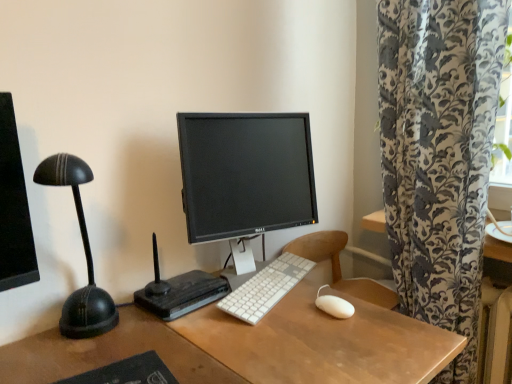
In order to face black rubber mousepad at lower left, should I rotate leftwards or rightwards?

A 19.798 degree turn to the left will do.

Locate an element on the screen. Image resolution: width=512 pixels, height=384 pixels. black plastic router at center is located at coordinates (179, 291).

At what (x,y) coordinates should I click in order to perform the action: click on black rubber mousepad at lower left. Please return your answer as a coordinate pair (x, y). The height and width of the screenshot is (384, 512). Looking at the image, I should click on (127, 372).

Does black rubber mousepad at lower left have a lesser width compared to white plastic keyboard at center?

No, black rubber mousepad at lower left is not thinner than white plastic keyboard at center.

From a real-world perspective, who is located lower, black rubber mousepad at lower left or white plastic keyboard at center?

In real-world perspective, black rubber mousepad at lower left is lower.

Does black rubber mousepad at lower left appear on the right side of white plastic keyboard at center?

Incorrect, black rubber mousepad at lower left is not on the right side of white plastic keyboard at center.

Who is smaller, black rubber mousepad at lower left or white plastic keyboard at center?

With smaller size is black rubber mousepad at lower left.

In the scene shown: Can black plastic router at center be found inside black rubber mousepad at lower left?

No, black plastic router at center is not a part of black rubber mousepad at lower left.

Locate an element on the screen. equipment behind the black rubber mousepad at lower left is located at coordinates (179, 291).

Is black rubber mousepad at lower left turned away from black plastic router at center?

black rubber mousepad at lower left does not have its back to black plastic router at center.

From a real-world perspective, who is located lower, black rubber mousepad at lower left or black plastic router at center?

From a 3D spatial view, black rubber mousepad at lower left is below.

Is black glossy monitor at center inside the boundaries of white matte mouse at center, or outside?

black glossy monitor at center is not inside white matte mouse at center, it's outside.

Is black glossy monitor at center not close to white matte mouse at center?

They are positioned close to each other.

How much distance is there between black glossy monitor at center and white matte mouse at center?

15.59 inches.

From a real-world perspective, between black glossy monitor at center and white matte mouse at center, who is vertically higher?

black glossy monitor at center, from a real-world perspective.

This screenshot has width=512, height=384. In order to click on computer monitor above the black plastic router at center (from the image's perspective) in this screenshot , I will do `click(245, 174)`.

In the scene shown: Is the position of black glossy monitor at center more distant than that of black plastic router at center?

Yes, black glossy monitor at center is behind black plastic router at center.

From a real-world perspective, is black glossy monitor at center physically below black plastic router at center?

No, from a real-world perspective, black glossy monitor at center is not below black plastic router at center.

Does black glossy monitor at center turn towards black plastic router at center?

No, black glossy monitor at center is not oriented towards black plastic router at center.

Is white matte mouse at center wider or thinner than black plastic router at center?

Considering their sizes, white matte mouse at center looks slimmer than black plastic router at center.

From the image's perspective, is white matte mouse at center on black plastic router at center?

No, from the image's perspective, white matte mouse at center is not above black plastic router at center.

From the picture: Does white matte mouse at center have a larger size compared to black plastic router at center?

No, white matte mouse at center is not bigger than black plastic router at center.

The height and width of the screenshot is (384, 512). I want to click on equipment above the white matte mouse at center (from a real-world perspective), so click(x=179, y=291).

Is black plastic router at center surrounded by white plastic keyboard at center?

Actually, black plastic router at center is outside white plastic keyboard at center.

From the image's perspective, which is above, white plastic keyboard at center or black plastic router at center?

black plastic router at center.

Is white plastic keyboard at center facing towards black plastic router at center?

No, white plastic keyboard at center is not aimed at black plastic router at center.

At what (x,y) coordinates should I click in order to perform the action: click on computer keyboard that appears below the black plastic router at center (from a real-world perspective). Please return your answer as a coordinate pair (x, y). The image size is (512, 384). Looking at the image, I should click on (265, 288).

How much distance is there between black plastic router at center and black glossy monitor at center?

10.53 inches.

Considering the relative sizes of black plastic router at center and black glossy monitor at center in the image provided, is black plastic router at center smaller than black glossy monitor at center?

Correct, black plastic router at center occupies less space than black glossy monitor at center.

Considering the sizes of black plastic router at center and black glossy monitor at center in the image, is black plastic router at center taller or shorter than black glossy monitor at center?

In the image, black plastic router at center appears to be shorter than black glossy monitor at center.

From the image's perspective, between black plastic router at center and black glossy monitor at center, which one is located above?

Answer: black glossy monitor at center appears higher in the image.

At what (x,y) coordinates should I click in order to perform the action: click on computer keyboard on the right of black rubber mousepad at lower left. Please return your answer as a coordinate pair (x, y). The height and width of the screenshot is (384, 512). Looking at the image, I should click on (265, 288).

I want to click on mousepad that is below the black plastic router at center (from the image's perspective), so click(x=127, y=372).

When comparing their distances from black rubber mousepad at lower left, does white plastic keyboard at center or black plastic router at center seem further?

Based on the image, white plastic keyboard at center appears to be further to black rubber mousepad at lower left.

From the image, which object appears to be farther from white plastic keyboard at center, black glossy monitor at center or black rubber mousepad at lower left?

The object further to white plastic keyboard at center is black rubber mousepad at lower left.

Looking at the image, which one is located further to white matte mouse at center, white plastic keyboard at center or black glossy monitor at center?

black glossy monitor at center is further to white matte mouse at center.

Looking at the image, which one is located closer to black glossy monitor at center, black rubber mousepad at lower left or white plastic keyboard at center?

white plastic keyboard at center.

When comparing their distances from white plastic keyboard at center, does black rubber mousepad at lower left or white matte mouse at center seem further?

black rubber mousepad at lower left is further to white plastic keyboard at center.

When comparing their distances from black glossy monitor at center, does white plastic keyboard at center or black rubber mousepad at lower left seem further?

Among the two, black rubber mousepad at lower left is located further to black glossy monitor at center.

From the image, which object appears to be nearer to black plastic router at center, black glossy monitor at center or white plastic keyboard at center?

Based on the image, white plastic keyboard at center appears to be nearer to black plastic router at center.

From the image, which object appears to be farther from white plastic keyboard at center, white matte mouse at center or black rubber mousepad at lower left?

The object further to white plastic keyboard at center is black rubber mousepad at lower left.

What are the coordinates of `computer keyboard between black plastic router at center and white matte mouse at center from left to right` in the screenshot? It's located at (265, 288).

At what (x,y) coordinates should I click in order to perform the action: click on computer monitor between black rubber mousepad at lower left and white matte mouse at center. Please return your answer as a coordinate pair (x, y). Looking at the image, I should click on (245, 174).

What are the coordinates of `equipment located between black rubber mousepad at lower left and white plastic keyboard at center in the depth direction` in the screenshot? It's located at (179, 291).

Where is `computer keyboard between black glossy monitor at center and white matte mouse at center in the vertical direction`? This screenshot has height=384, width=512. computer keyboard between black glossy monitor at center and white matte mouse at center in the vertical direction is located at coordinates tap(265, 288).